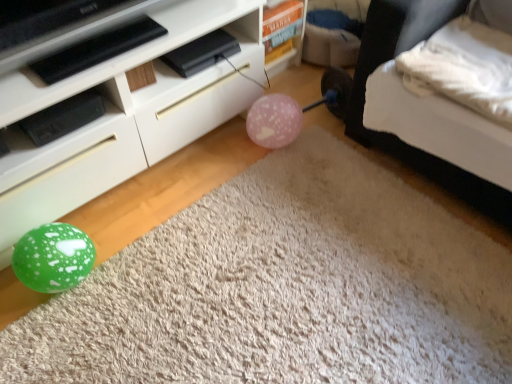
Question: From the image's perspective, would you say green glossy balloon at lower left is shown under pink matte balloon at center?

Choices:
 (A) no
 (B) yes

Answer: (B)

Question: From a real-world perspective, is green glossy balloon at lower left positioned over pink matte balloon at center based on gravity?

Choices:
 (A) yes
 (B) no

Answer: (B)

Question: Is green glossy balloon at lower left positioned beyond the bounds of pink matte balloon at center?

Choices:
 (A) no
 (B) yes

Answer: (B)

Question: Can you confirm if green glossy balloon at lower left is bigger than pink matte balloon at center?

Choices:
 (A) yes
 (B) no

Answer: (A)

Question: Could pink matte balloon at center be considered to be inside green glossy balloon at lower left?

Choices:
 (A) yes
 (B) no

Answer: (B)

Question: Is pink matte balloon at center at the back of green glossy balloon at lower left?

Choices:
 (A) yes
 (B) no

Answer: (B)

Question: Is white glossy cabinet at lower left facing away from white soft bed at lower right?

Choices:
 (A) no
 (B) yes

Answer: (A)

Question: Is white glossy cabinet at lower left to the left of white soft bed at lower right from the viewer's perspective?

Choices:
 (A) yes
 (B) no

Answer: (A)

Question: Does white glossy cabinet at lower left appear on the right side of white soft bed at lower right?

Choices:
 (A) yes
 (B) no

Answer: (B)

Question: Can you confirm if white glossy cabinet at lower left is shorter than white soft bed at lower right?

Choices:
 (A) no
 (B) yes

Answer: (B)

Question: From a real-world perspective, is white glossy cabinet at lower left physically above white soft bed at lower right?

Choices:
 (A) no
 (B) yes

Answer: (A)

Question: Is white glossy cabinet at lower left in front of white soft bed at lower right?

Choices:
 (A) no
 (B) yes

Answer: (A)

Question: Is white soft bed at lower right smaller than pink matte balloon at center?

Choices:
 (A) no
 (B) yes

Answer: (A)